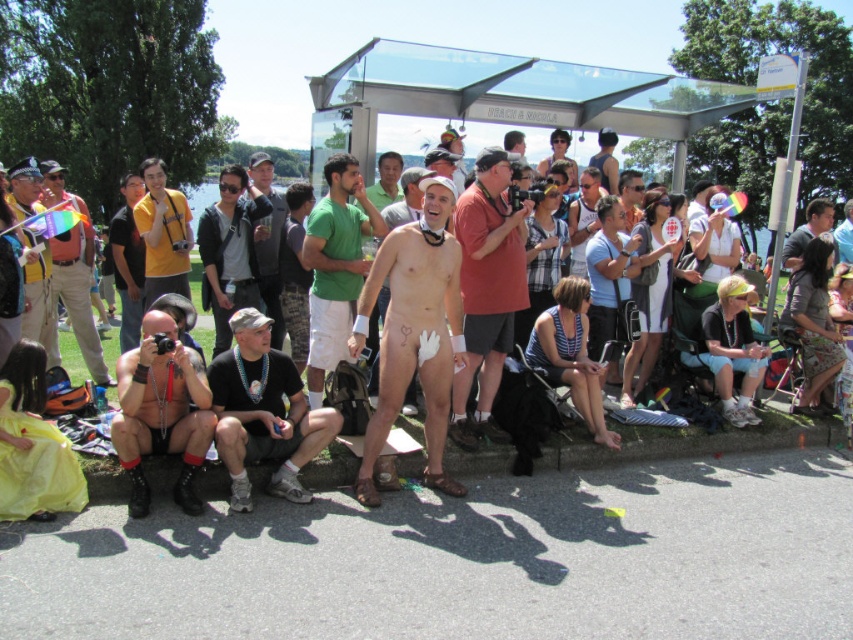
Looking at this image, you are a photographer trying to decide which equipment to use. You have a matte black camera at left and a matte yellow hat at left. Which one can you use to take a photo?

The matte black camera at left can be used to take a photo since it is a camera, while the matte yellow hat at left is just a hat and cannot take photos.

You are organizing a costume party and need to ensure that all accessories fit properly. You have a green matte shorts at center and a matte yellow hat at left. Which accessory has a narrower width?

The green matte shorts at center has a lesser width compared to the matte yellow hat at left, so the green matte shorts at center is narrower in width.